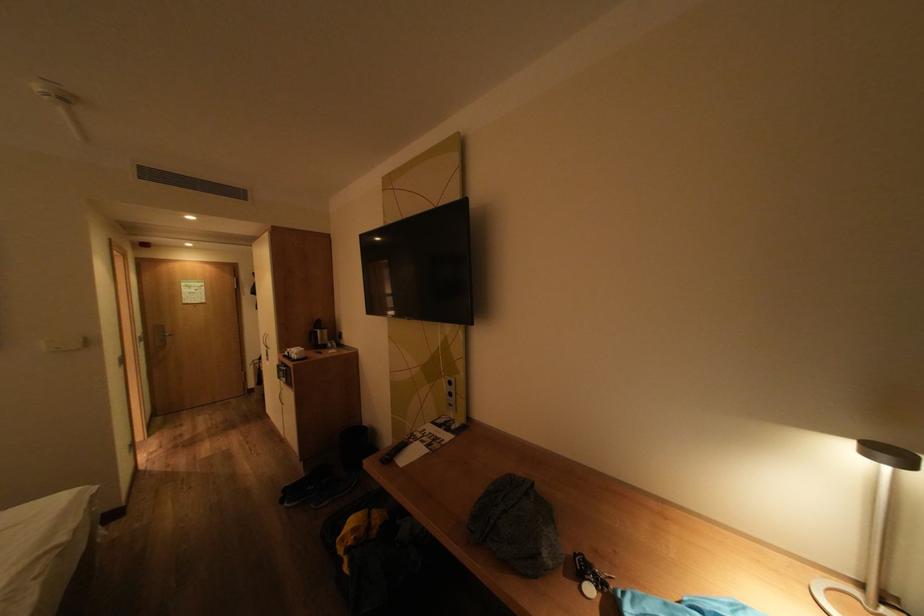
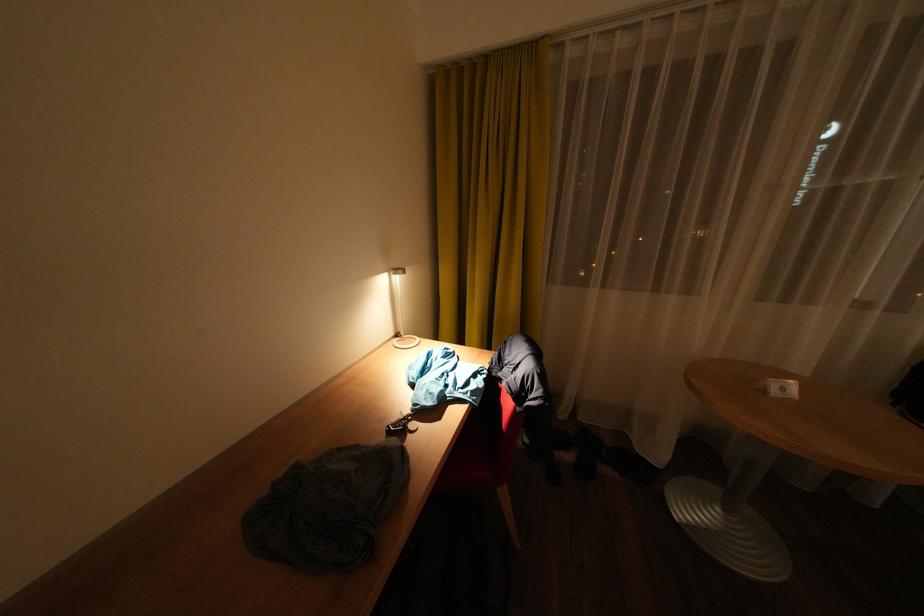
The first image is from the beginning of the video and the second image is from the end. How did the camera likely rotate when shooting the video?

The camera rotated toward right-down.